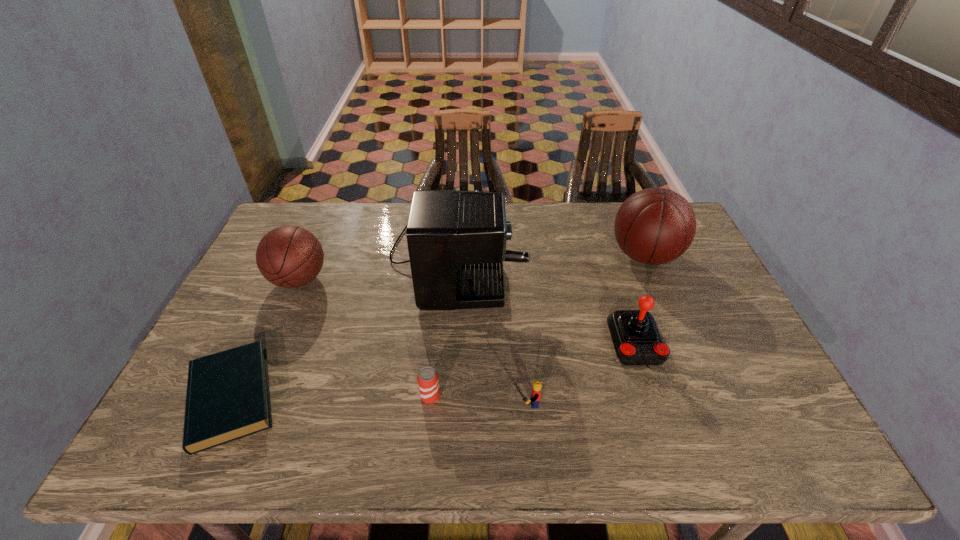
The height and width of the screenshot is (540, 960). Identify the location of the tallest object. click(456, 240).

This screenshot has width=960, height=540. Identify the location of the sixth shortest object. (654, 226).

I want to click on the taller basketball, so click(654, 226).

This screenshot has height=540, width=960. In order to click on the left basketball in this screenshot , I will do `click(288, 256)`.

The image size is (960, 540). Identify the location of joystick. (637, 340).

The image size is (960, 540). What are the coordinates of `the fifth tallest object` in the screenshot? It's located at (537, 385).

What are the coordinates of `the sixth tallest object` in the screenshot? It's located at (428, 382).

Locate an element on the screen. The width and height of the screenshot is (960, 540). the shortest object is located at coordinates (228, 398).

In order to click on free point located on the front-facing side of the tallest object in this screenshot , I will do `click(612, 254)`.

The image size is (960, 540). Identify the location of vacant space situated on the back of the right basketball. (624, 206).